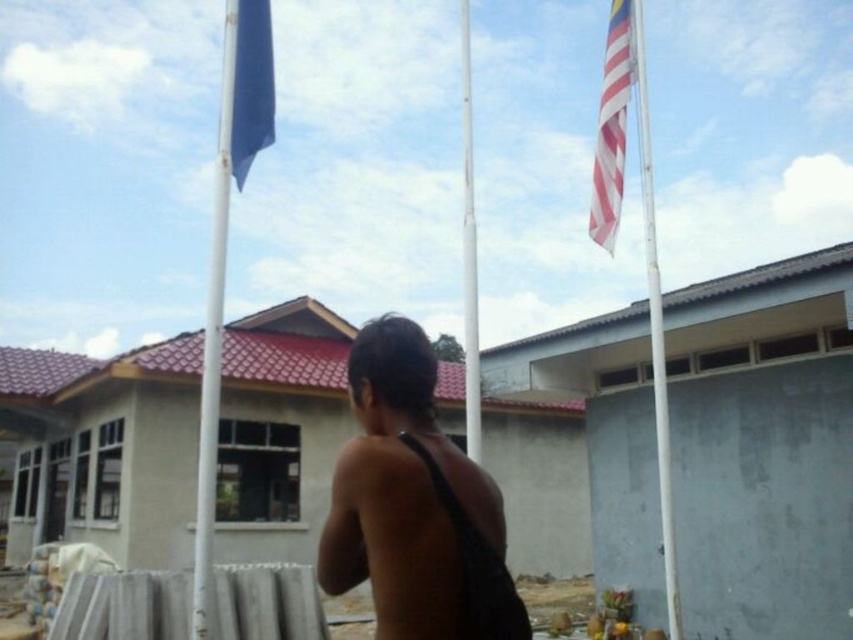
Question: Which of these objects is positioned closest to the black matte tank top at center?

Choices:
 (A) white metallic pole at center
 (B) white metallic flag pole at upper right
 (C) blue fabric flag at upper left

Answer: (C)

Question: Can you confirm if white metallic flag pole at upper right is thinner than blue fabric flag at upper left?

Choices:
 (A) yes
 (B) no

Answer: (B)

Question: Which point appears closest to the camera in this image?

Choices:
 (A) (241, 61)
 (B) (619, 90)
 (C) (479, 372)

Answer: (A)

Question: Does black matte tank top at center appear under striped fabric flag at upper right?

Choices:
 (A) no
 (B) yes

Answer: (B)

Question: Which object is closer to the camera taking this photo?

Choices:
 (A) white glossy flag pole at left
 (B) white metallic flag pole at upper right

Answer: (A)

Question: From the image, what is the correct spatial relationship of black matte tank top at center in relation to white glossy flag pole at left?

Choices:
 (A) left
 (B) right

Answer: (B)